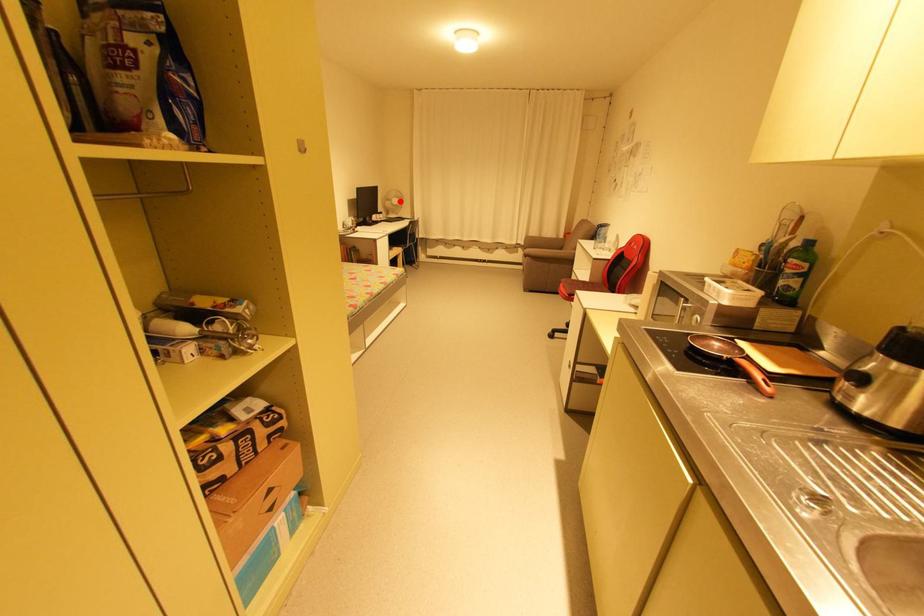
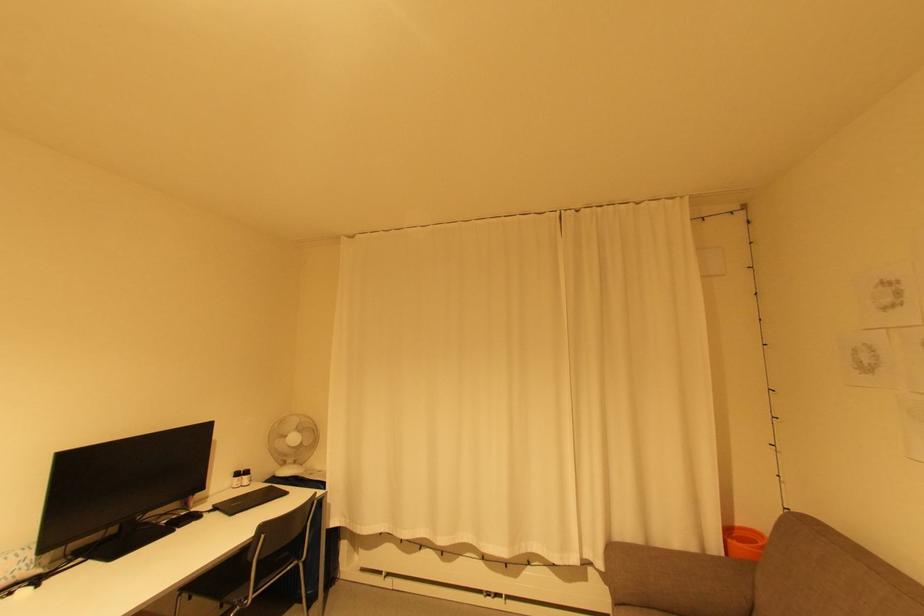
Question: A red point is marked in image1. In image2, is the corresponding 3D point closer to the camera or farther? Reply with the corresponding letter.

Choices:
 (A) The corresponding 3D point is closer.
 (B) The corresponding 3D point is farther.

Answer: (B)